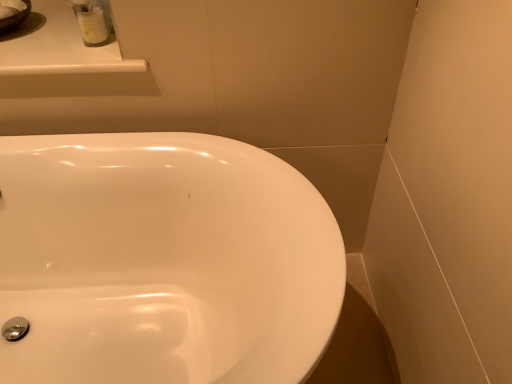
Where is `free space that is to the left of white glossy container at upper left`? free space that is to the left of white glossy container at upper left is located at coordinates tap(44, 45).